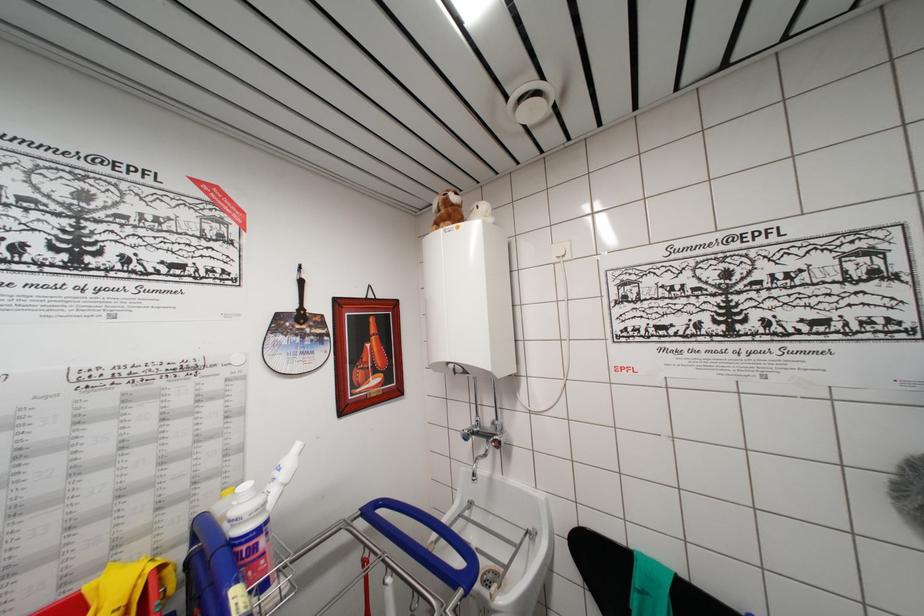
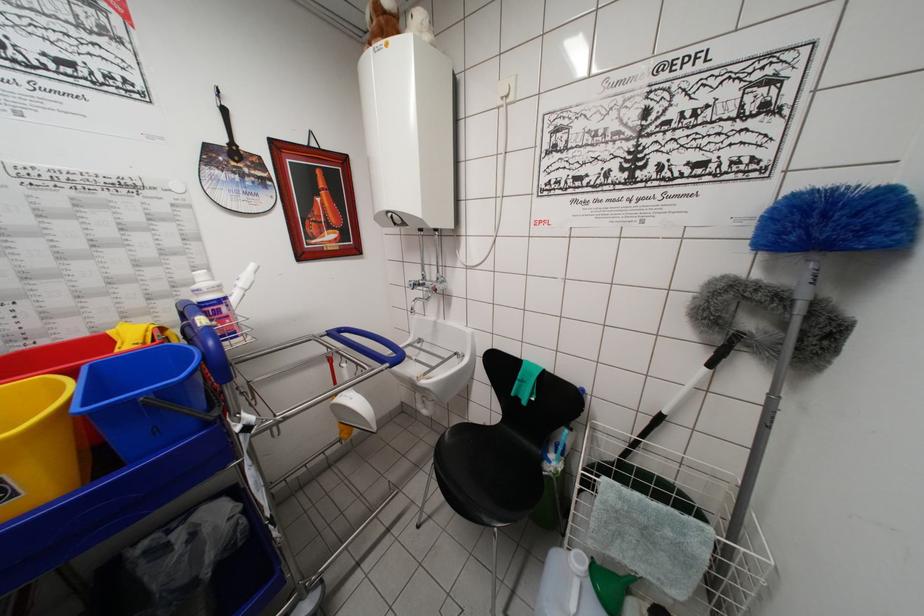
Question: Based on the continuous images, in which direction is the camera rotating? Reply with the corresponding letter.

Choices:
 (A) Left
 (B) Right
 (C) Up
 (D) Down

Answer: (D)